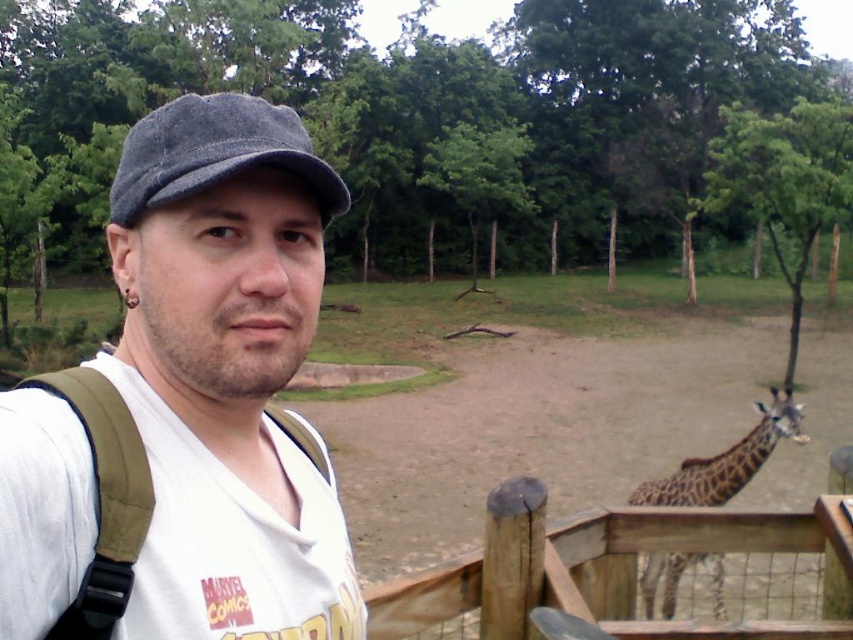
You are a zookeeper planning to place a new feeding station between the wooden at right and the brown spotted giraffe at lower right. Based on their sizes, which object should the feeding station be closer to?

The wooden at right is bigger than the brown spotted giraffe at lower right, so the feeding station should be placed closer to the brown spotted giraffe at lower right to ensure adequate space for both.